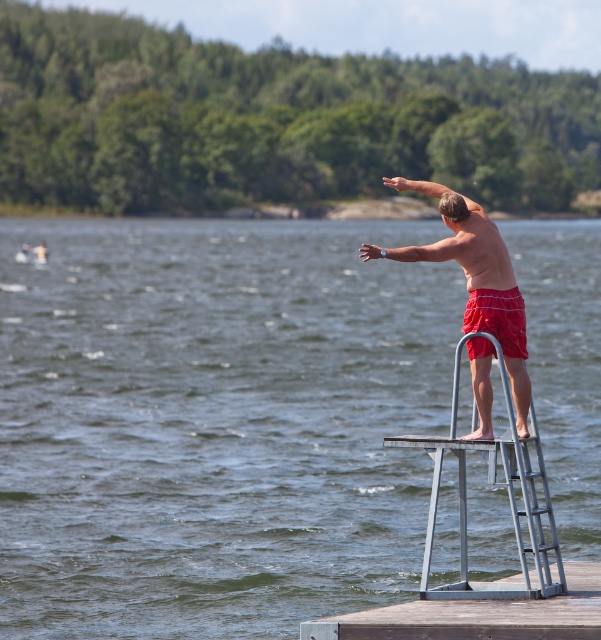
Question: Which of the following is the farthest from the observer?

Choices:
 (A) (445, 189)
 (B) (481, 592)
 (C) (477, 352)
 (D) (542, 612)

Answer: (A)

Question: Which object is positioned farthest from the silver metallic diving board at center?

Choices:
 (A) smooth skin arm at upper center
 (B) brown wooden dock at lower right
 (C) matte white wristwatch at upper right

Answer: (A)

Question: Which of these objects is positioned farthest from the smooth skin arm at upper center?

Choices:
 (A) matte white wristwatch at upper right
 (B) clear blue water at center
 (C) red swim trunks at center

Answer: (B)

Question: Does brown wooden dock at lower right lie in front of red swim trunks at center?

Choices:
 (A) no
 (B) yes

Answer: (A)

Question: Is clear blue water at center smaller than smooth skin arm at upper center?

Choices:
 (A) no
 (B) yes

Answer: (A)

Question: Observing the image, what is the correct spatial positioning of red cotton shorts at center in reference to matte white wristwatch at upper right?

Choices:
 (A) right
 (B) left

Answer: (A)